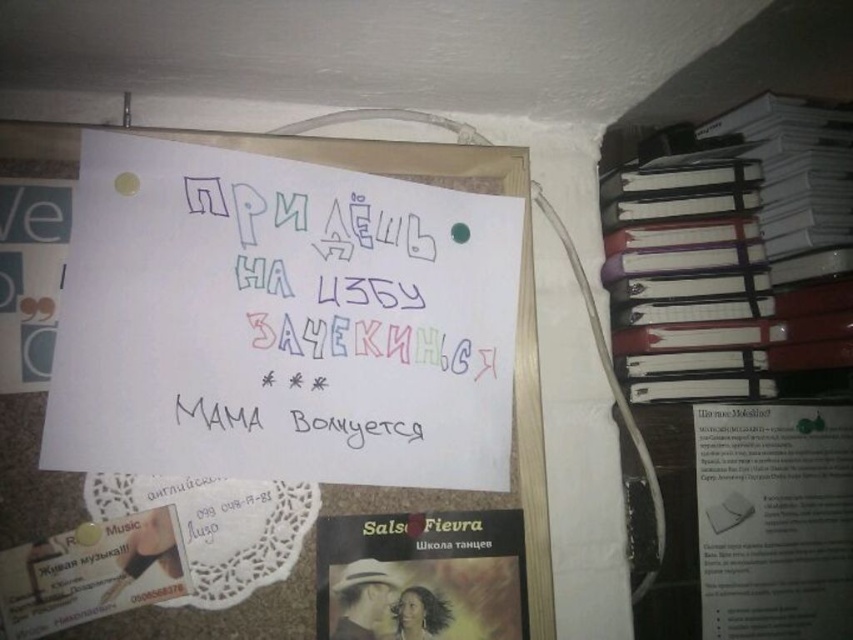
You have a ruler that measures 6 inches. You want to measure the distance between the colored paper note at center and the matte black book at center. Will your ruler be long enough?

The colored paper note at center and the matte black book at center are 6.49 inches apart. Since your ruler is only 6 inches long, it is not long enough to measure the full distance between them.

You are organizing a bulletin board and need to ensure that the colored paper note at center and the matte black book at center are arranged properly. Based on their sizes, which object should be placed higher up to avoid covering the other?

The colored paper note at center is taller than the matte black book at center, so to avoid covering it, the colored paper note at center should be placed higher up.

In the scene shown: You are organizing a bulletin board and need to access the content underneath the white paper at upper center. Can you move the white paper at right to reveal it?

The white paper at right is positioned over the white paper at upper center, so moving the white paper at right will reveal the content underneath the white paper at upper center.